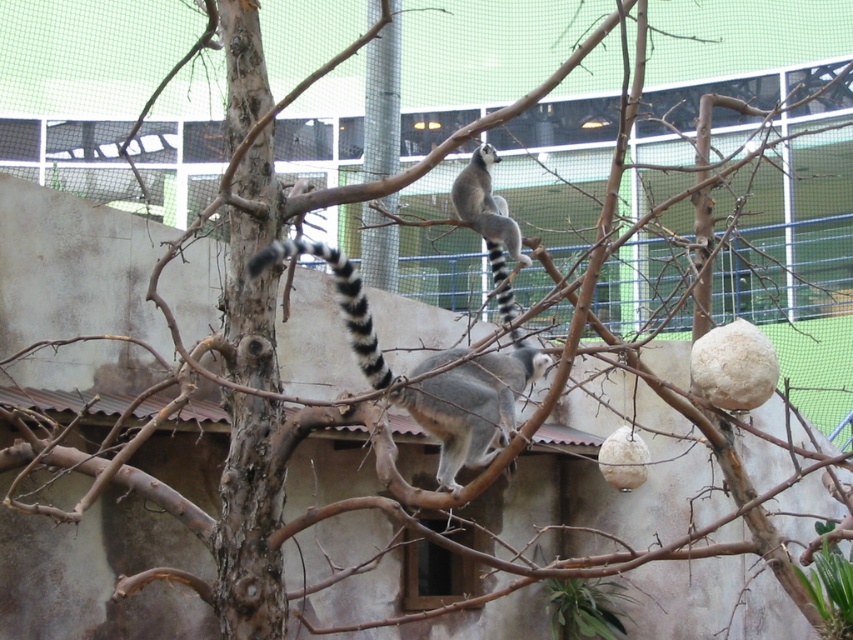
Question: Is ring-tailed lemur at center bigger than black and white striped tail at center?

Choices:
 (A) yes
 (B) no

Answer: (B)

Question: Which of the following is the farthest from the observer?

Choices:
 (A) ring-tailed lemur at center
 (B) ring-tailed fur at center

Answer: (A)

Question: Observing the image, what is the correct spatial positioning of ring-tailed fur at center in reference to ring-tailed lemur at center?

Choices:
 (A) above
 (B) below

Answer: (B)

Question: Can you confirm if ring-tailed lemur at center is positioned below black and white striped tail at center?

Choices:
 (A) yes
 (B) no

Answer: (B)

Question: Which object is farther from the camera taking this photo?

Choices:
 (A) ring-tailed fur at center
 (B) ring-tailed lemur at center
 (C) black and white striped tail at center

Answer: (B)

Question: Among these objects, which one is nearest to the camera?

Choices:
 (A) ring-tailed fur at center
 (B) ring-tailed lemur at center
 (C) black and white striped tail at center

Answer: (C)